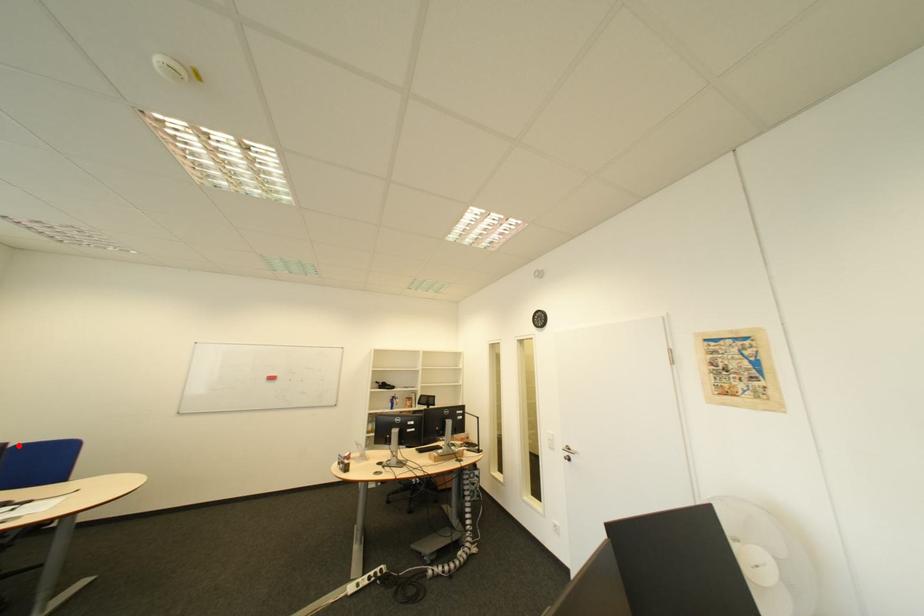
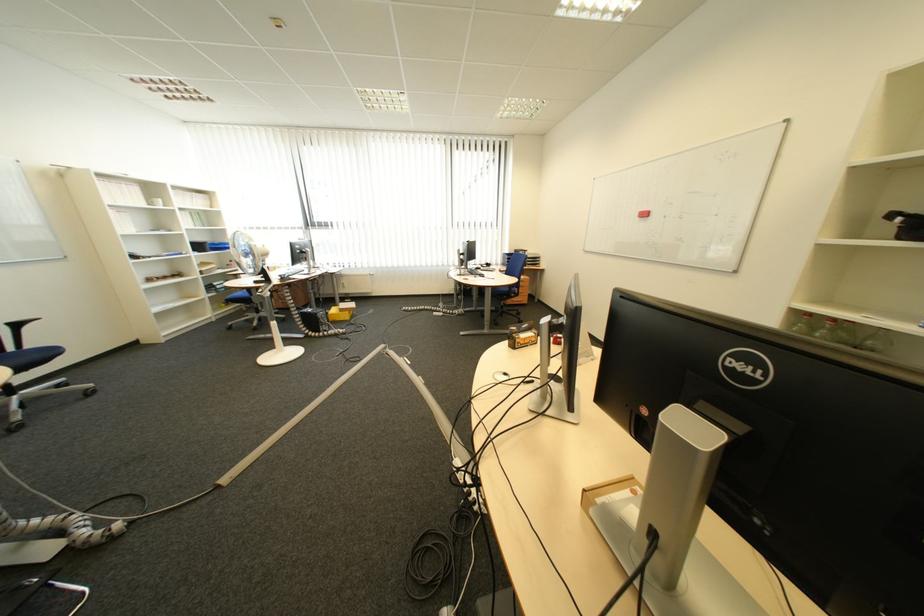
Question: I am providing you with two images of the same scene from different viewpoints. A red point is marked on the first image. Is the red point's position out of view in image 2?

Choices:
 (A) Yes
 (B) No

Answer: (A)